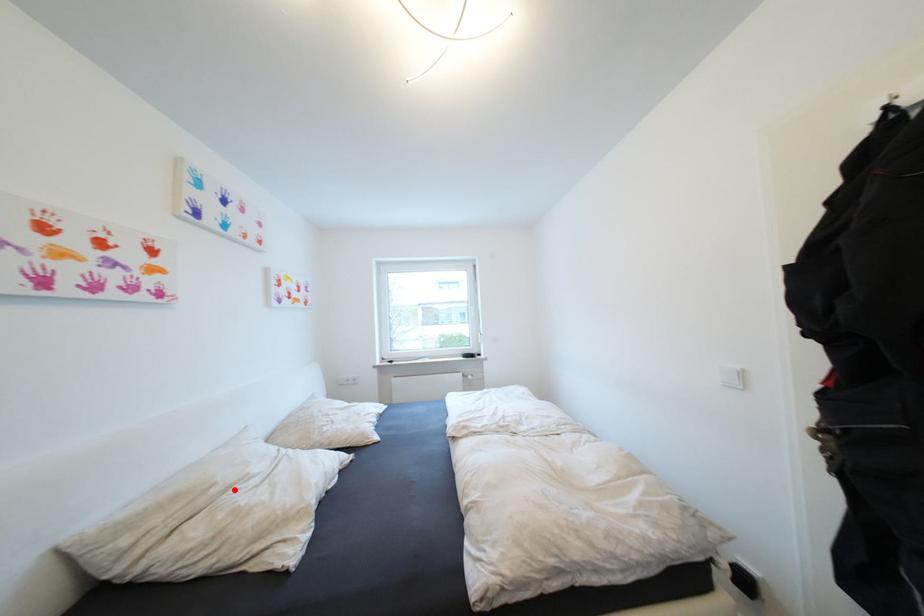
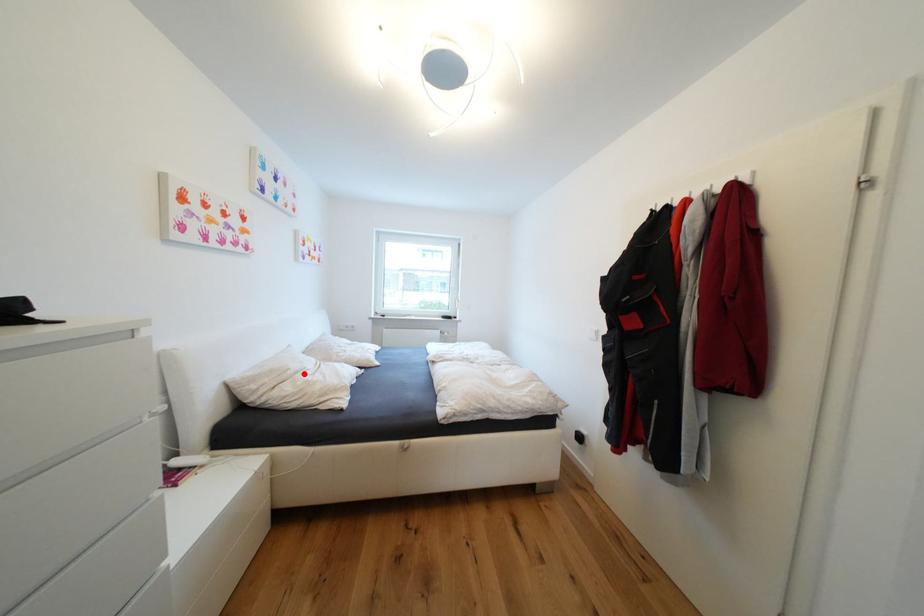
I am providing you with two images of the same scene from different viewpoints. A red point is marked on the first image and another point is marked on the second image. Do the highlighted points in image1 and image2 indicate the same real-world spot?

Yes